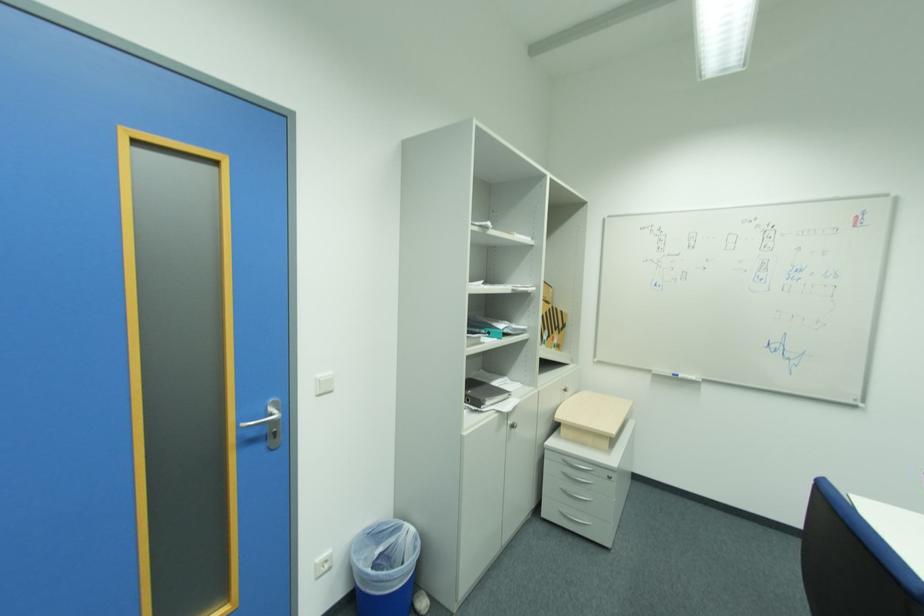
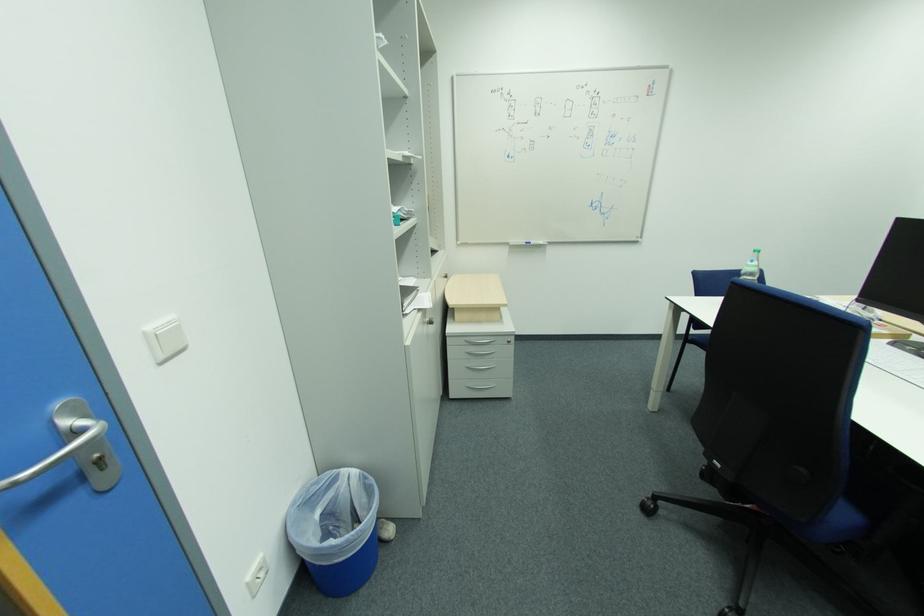
In the second image, find the point that corresponds to point 699,379 in the first image.

(546, 244)